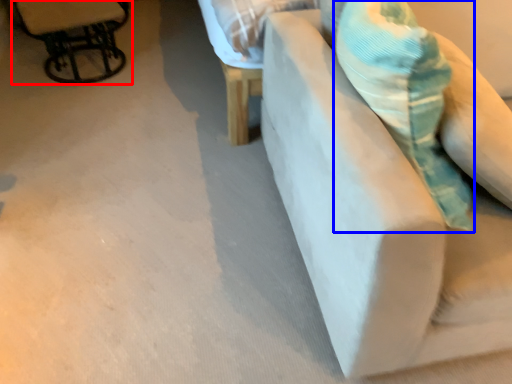
Question: Which of the following is the farthest to the observer, chair (highlighted by a red box) or throw pillow (highlighted by a blue box)?

Choices:
 (A) chair
 (B) throw pillow

Answer: (A)